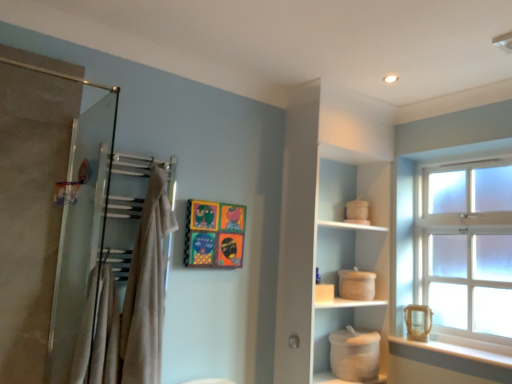
Question: From a real-world perspective, is beige cotton bath towel at upper left, marked as the first bath towel in a right-to-left arrangement, positioned over beige cotton bath towel at left, acting as the second bath towel starting from the right, based on gravity?

Choices:
 (A) yes
 (B) no

Answer: (A)

Question: Considering the relative sizes of beige cotton bath towel at upper left, marked as the first bath towel in a right-to-left arrangement, and beige cotton bath towel at left, acting as the second bath towel starting from the right, in the image provided, is beige cotton bath towel at upper left, marked as the first bath towel in a right-to-left arrangement, wider than beige cotton bath towel at left, acting as the second bath towel starting from the right,?

Choices:
 (A) yes
 (B) no

Answer: (B)

Question: Is beige cotton bath towel at upper left, which is the second bath towel in left-to-right order, next to beige cotton bath towel at left, acting as the second bath towel starting from the right?

Choices:
 (A) yes
 (B) no

Answer: (B)

Question: Does beige cotton bath towel at upper left, marked as the first bath towel in a right-to-left arrangement, have a greater height compared to beige cotton bath towel at left, which appears as the first bath towel when viewed from the left?

Choices:
 (A) no
 (B) yes

Answer: (B)

Question: Is beige cotton bath towel at upper left, marked as the first bath towel in a right-to-left arrangement, shorter than beige cotton bath towel at left, which appears as the first bath towel when viewed from the left?

Choices:
 (A) no
 (B) yes

Answer: (A)

Question: Relative to white matte pot at lower center, is clear glass window at upper right in front or behind?

Choices:
 (A) behind
 (B) front

Answer: (B)

Question: From the image's perspective, is clear glass window at upper right located above or below white matte pot at lower center?

Choices:
 (A) below
 (B) above

Answer: (B)

Question: Is clear glass window at upper right spatially inside white matte pot at lower center, or outside of it?

Choices:
 (A) outside
 (B) inside

Answer: (A)

Question: Is clear glass window at upper right taller or shorter than white matte pot at lower center?

Choices:
 (A) short
 (B) tall

Answer: (B)

Question: Considering the positions of clear glass window at upper right and white matte cabinet at center in the image, is clear glass window at upper right bigger or smaller than white matte cabinet at center?

Choices:
 (A) big
 (B) small

Answer: (B)

Question: From a real-world perspective, is clear glass window at upper right physically located above or below white matte cabinet at center?

Choices:
 (A) below
 (B) above

Answer: (B)

Question: Is clear glass window at upper right situated inside white matte cabinet at center or outside?

Choices:
 (A) outside
 (B) inside

Answer: (A)

Question: Looking at their shapes, would you say clear glass window at upper right is wider or thinner than white matte cabinet at center?

Choices:
 (A) wide
 (B) thin

Answer: (B)

Question: From the image's perspective, is beige cotton bath towel at upper left, which is the second bath towel in left-to-right order, located above or below white matte cabinet at center?

Choices:
 (A) below
 (B) above

Answer: (B)

Question: From a real-world perspective, is beige cotton bath towel at upper left, which is the second bath towel in left-to-right order, positioned above or below white matte cabinet at center?

Choices:
 (A) above
 (B) below

Answer: (B)